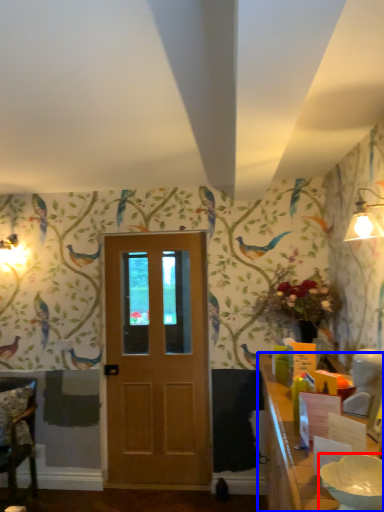
Question: Which object is further to the camera taking this photo, bowl (highlighted by a red box) or table (highlighted by a blue box)?

Choices:
 (A) bowl
 (B) table

Answer: (A)